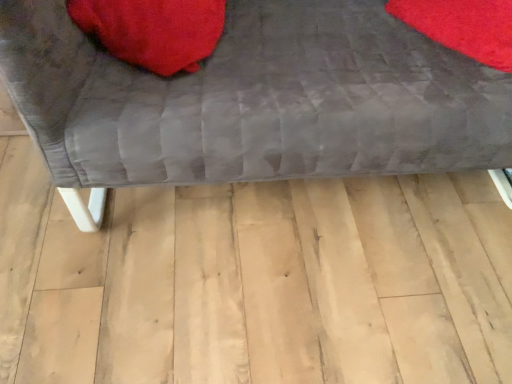
Question: Considering the relative sizes of velvet gray couch at center and velvet red bean bag at upper left in the image provided, is velvet gray couch at center smaller than velvet red bean bag at upper left?

Choices:
 (A) yes
 (B) no

Answer: (B)

Question: Can you confirm if velvet gray couch at center is thinner than velvet red bean bag at upper left?

Choices:
 (A) no
 (B) yes

Answer: (A)

Question: Is velvet gray couch at center wider than velvet red bean bag at upper left?

Choices:
 (A) no
 (B) yes

Answer: (B)

Question: Is velvet red bean bag at upper left located within velvet gray couch at center?

Choices:
 (A) yes
 (B) no

Answer: (A)

Question: Does velvet gray couch at center have a lesser height compared to velvet red bean bag at upper left?

Choices:
 (A) no
 (B) yes

Answer: (A)

Question: Is velvet gray couch at center directly adjacent to velvet red bean bag at upper left?

Choices:
 (A) no
 (B) yes

Answer: (A)

Question: Considering the relative sizes of velvet red bean bag at upper left and velvet gray couch at center in the image provided, is velvet red bean bag at upper left bigger than velvet gray couch at center?

Choices:
 (A) yes
 (B) no

Answer: (B)

Question: From the image's perspective, is velvet red bean bag at upper left below velvet gray couch at center?

Choices:
 (A) yes
 (B) no

Answer: (B)

Question: Is velvet red bean bag at upper left taller than velvet gray couch at center?

Choices:
 (A) yes
 (B) no

Answer: (B)

Question: Is velvet red bean bag at upper left beside velvet gray couch at center?

Choices:
 (A) no
 (B) yes

Answer: (A)

Question: From a real-world perspective, is velvet red bean bag at upper left over velvet gray couch at center?

Choices:
 (A) no
 (B) yes

Answer: (B)

Question: Is velvet red bean bag at upper left to the left of velvet gray couch at center from the viewer's perspective?

Choices:
 (A) yes
 (B) no

Answer: (A)

Question: From the image's perspective, is velvet red bean bag at upper left located above or below velvet gray couch at center?

Choices:
 (A) below
 (B) above

Answer: (B)